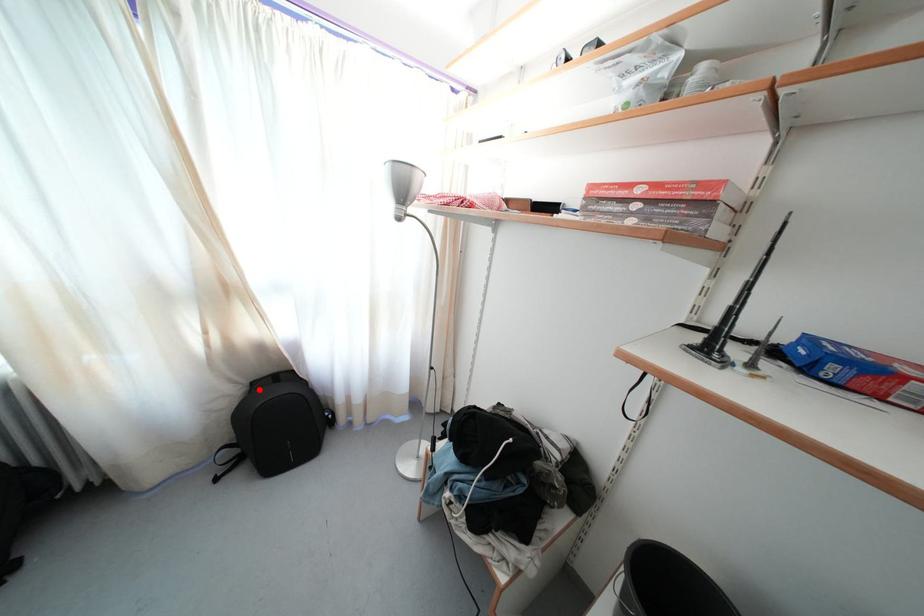
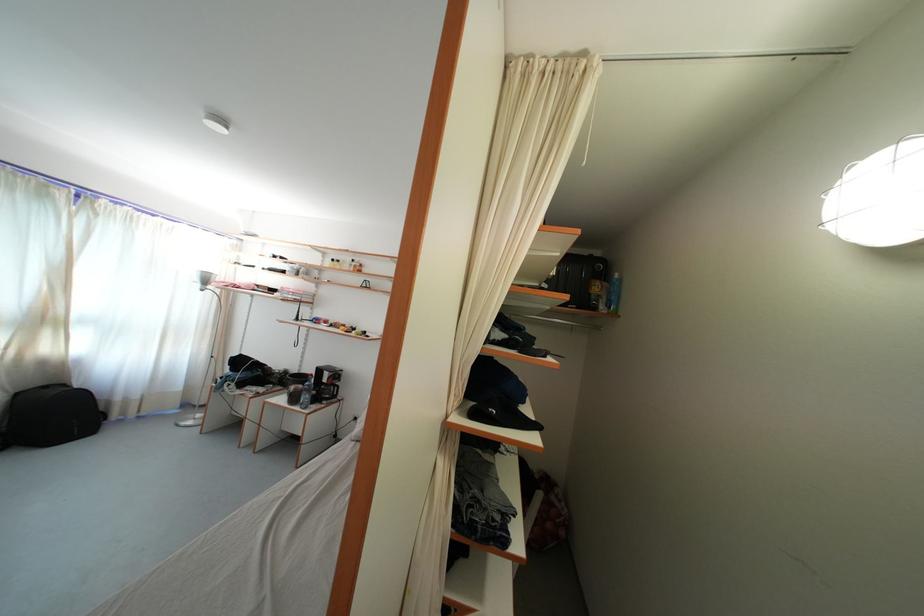
The point at the highlighted location is marked in the first image. Where is the corresponding point in the second image?

(23, 400)